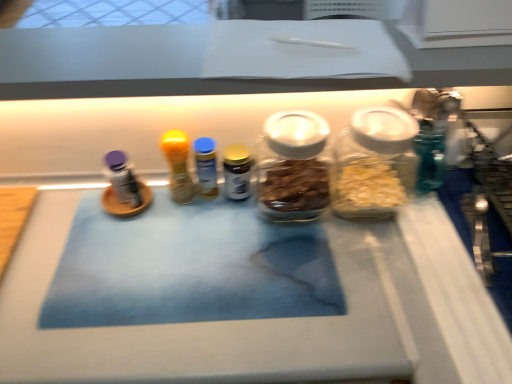
Image resolution: width=512 pixels, height=384 pixels. I want to click on free space in front of yellow matte bottle at center, marked as the 1th bottle in a left-to-right arrangement, so click(170, 263).